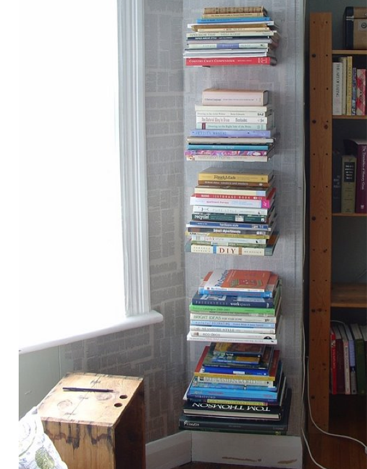
At what (x,y) coordinates should I click in order to perform the action: click on electric cord. Please return your answer as a coordinate pair (x, y). Image resolution: width=367 pixels, height=469 pixels. Looking at the image, I should click on (314, 425).